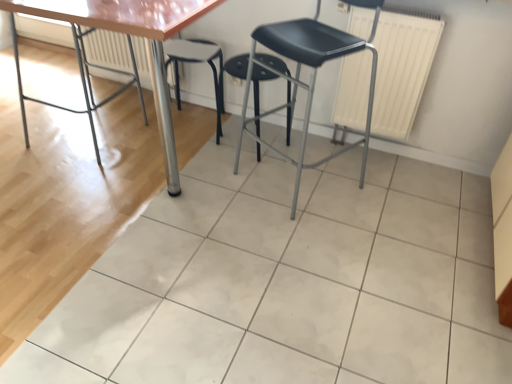
Where is `vacant area that is situated to the right of metallic polished table at left`? The image size is (512, 384). vacant area that is situated to the right of metallic polished table at left is located at coordinates (157, 152).